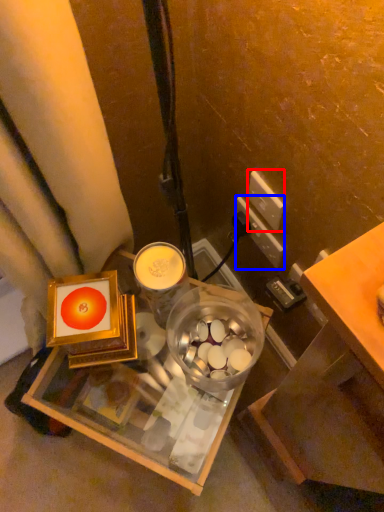
Question: Which object appears farthest to the camera in this image, power outlet (highlighted by a red box) or power outlet (highlighted by a blue box)?

Choices:
 (A) power outlet
 (B) power outlet

Answer: (B)